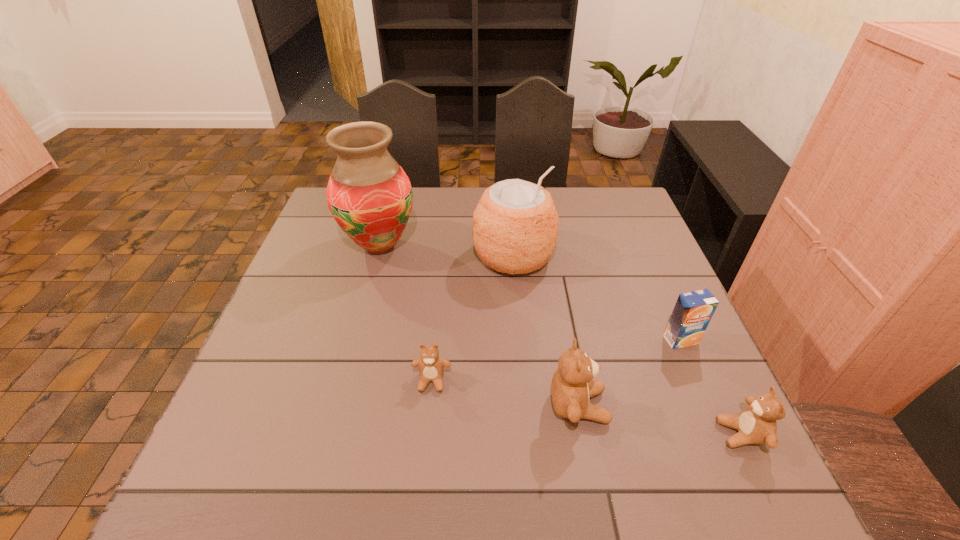
The width and height of the screenshot is (960, 540). In order to click on the shortest teddy bear in this screenshot , I will do `click(431, 366)`.

Locate an element on the screen. Image resolution: width=960 pixels, height=540 pixels. the fifth object from right to left is located at coordinates (431, 366).

Where is `the second teddy bear from right to left`? The height and width of the screenshot is (540, 960). the second teddy bear from right to left is located at coordinates coord(572,386).

I want to click on the third tallest object, so click(x=572, y=386).

Find the location of a particular element. The height and width of the screenshot is (540, 960). the second tallest teddy bear is located at coordinates (756, 424).

Locate an element on the screen. This screenshot has width=960, height=540. coconut is located at coordinates (515, 225).

Identify the location of orange_juice. (693, 310).

You are a GUI agent. You are given a task and a screenshot of the screen. Output one action in this format:
    pyautogui.click(x=<x>, y=<y>)
    Task: Click on the tallest object
    Image resolution: width=960 pixels, height=540 pixels.
    Given the screenshot: What is the action you would take?
    (x=369, y=195)

Identify the location of vase. This screenshot has width=960, height=540. (369, 195).

At what (x,y) coordinates should I click in order to perform the action: click on vacant space situated 0.100m on the front-facing side of the leftmost teddy bear. Please return your answer as a coordinate pair (x, y). Image resolution: width=960 pixels, height=540 pixels. Looking at the image, I should click on (426, 440).